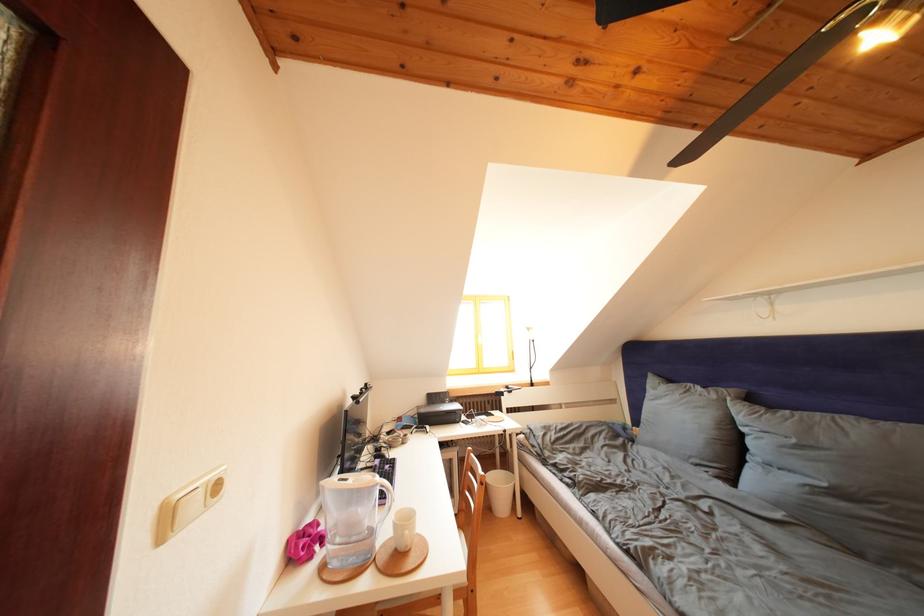
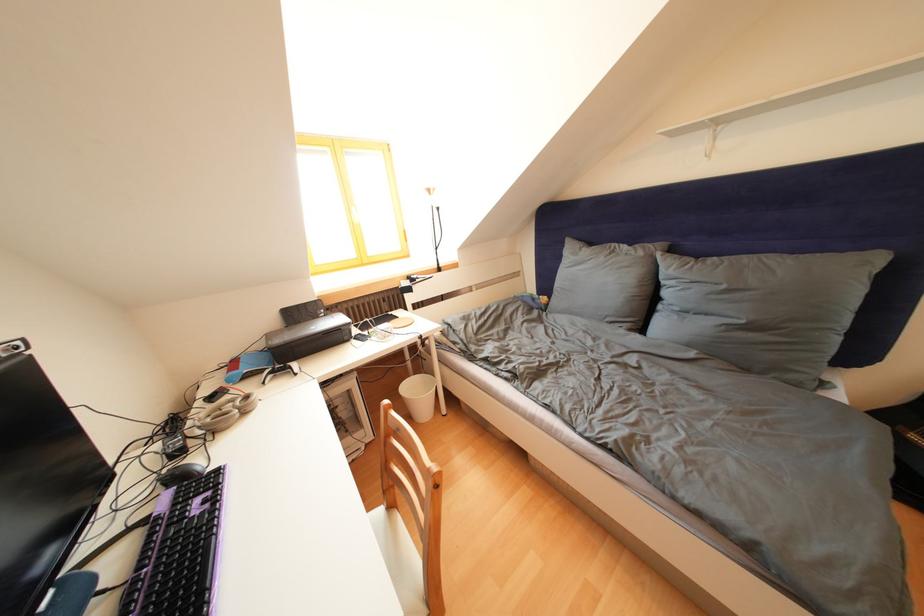
Based on the continuous images, in which direction is the camera rotating?

The camera rotated toward right-down.